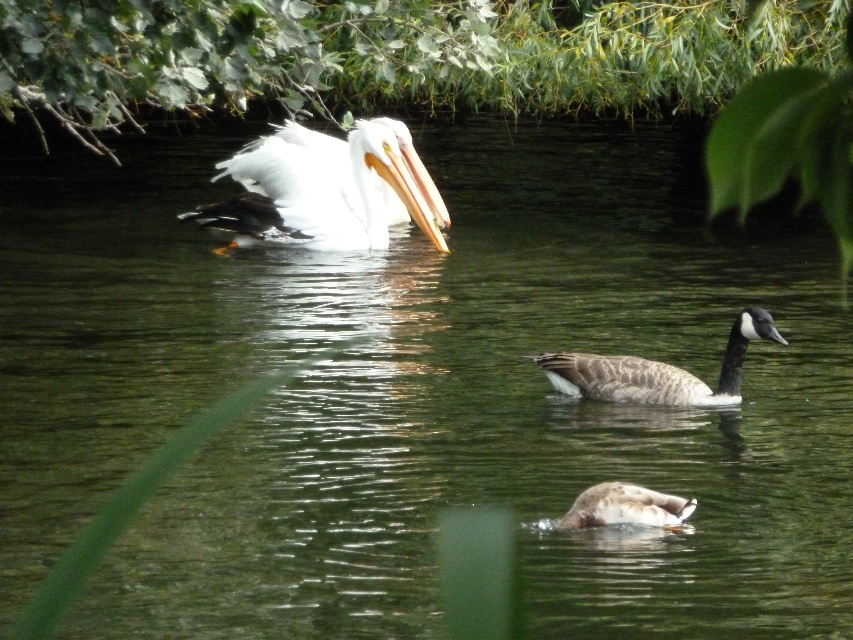
Question: Does white glossy pelican at upper left have a larger size compared to brown matte duck at center?

Choices:
 (A) no
 (B) yes

Answer: (B)

Question: Which of the following is the farthest from the observer?

Choices:
 (A) brown matte duck at center
 (B) brown speckled goose at center

Answer: (B)

Question: Does brown speckled goose at center appear on the right side of brown matte duck at center?

Choices:
 (A) no
 (B) yes

Answer: (B)

Question: Which object is closer to the camera taking this photo?

Choices:
 (A) white glossy pelican at upper left
 (B) white smooth beak at center
 (C) brown speckled goose at center
 (D) brown matte duck at center

Answer: (D)

Question: Does white glossy pelican at upper left have a greater width compared to brown speckled goose at center?

Choices:
 (A) yes
 (B) no

Answer: (A)

Question: Which object is positioned farthest from the white glossy pelican at upper left?

Choices:
 (A) brown matte duck at center
 (B) brown speckled goose at center

Answer: (A)